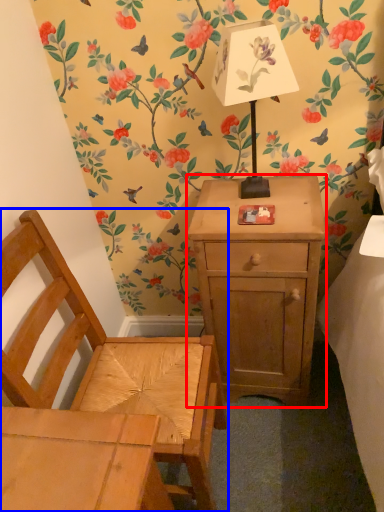
Question: Which object appears closest to the camera in this image, nightstand (highlighted by a red box) or chair (highlighted by a blue box)?

Choices:
 (A) nightstand
 (B) chair

Answer: (B)